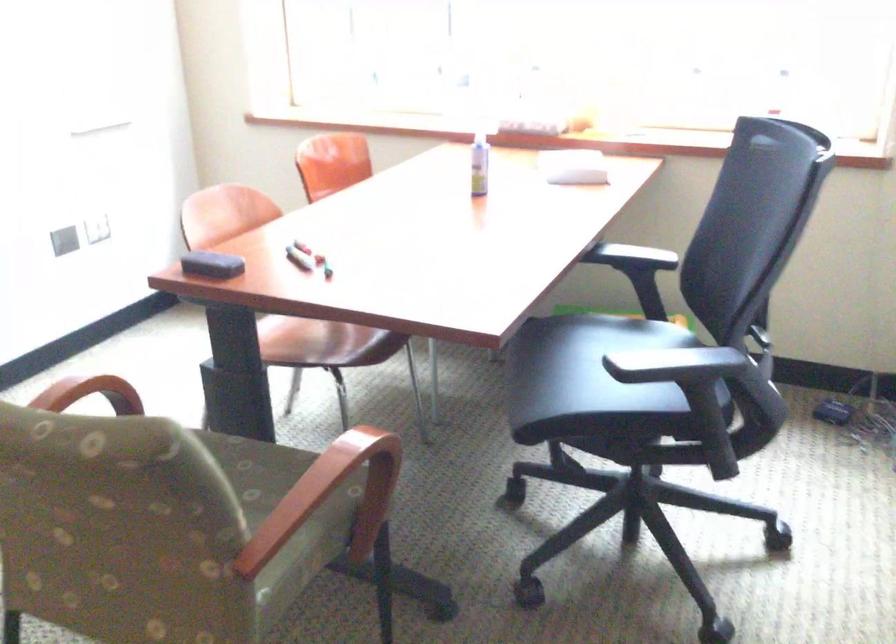
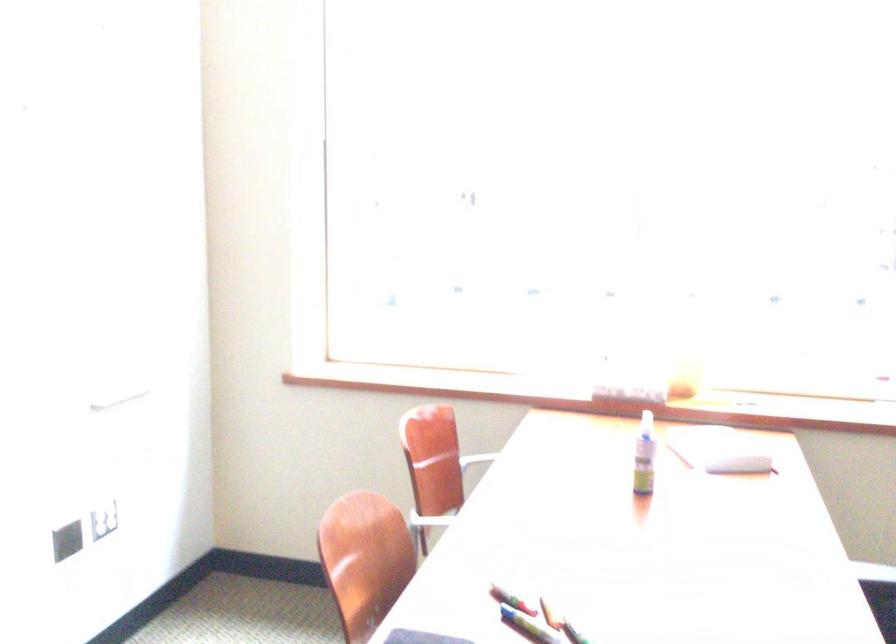
Question: Based on the continuous images, in which direction is the camera rotating? Reply with the corresponding letter.

Choices:
 (A) Left
 (B) Right
 (C) Up
 (D) Down

Answer: (C)